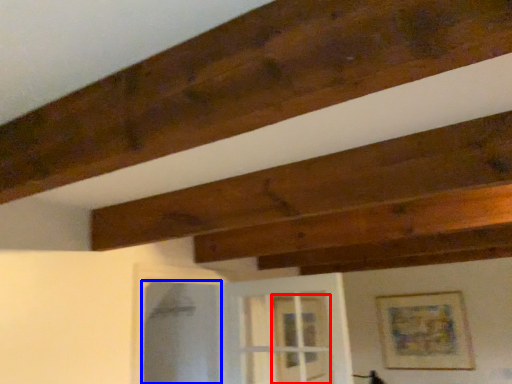
Question: Which object is further to the camera taking this photo, glass door (highlighted by a red box) or screen door (highlighted by a blue box)?

Choices:
 (A) glass door
 (B) screen door

Answer: (A)